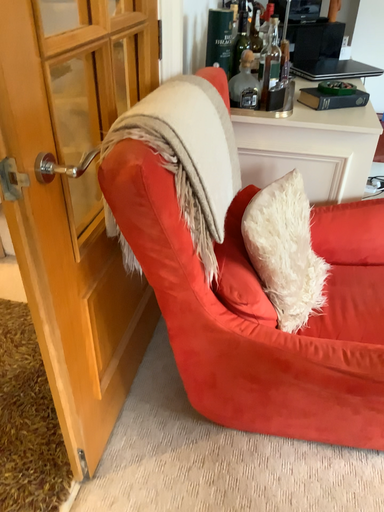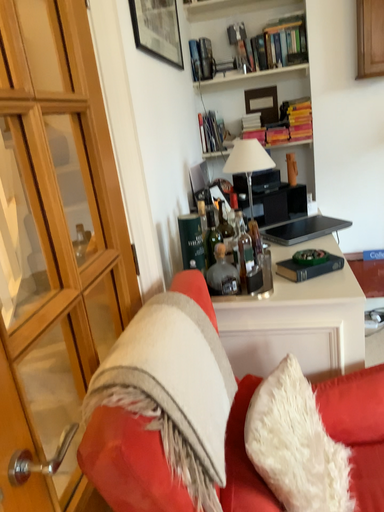
Question: How did the camera likely rotate when shooting the video?

Choices:
 (A) rotated upward
 (B) rotated downward

Answer: (A)